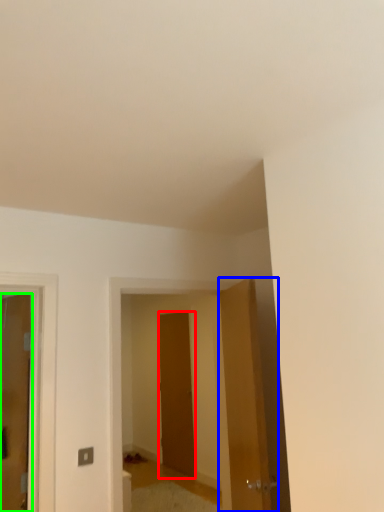
Question: Which object is positioned farthest from door (highlighted by a red box)? Select from door (highlighted by a blue box) and door (highlighted by a green box).

Choices:
 (A) door
 (B) door

Answer: (B)